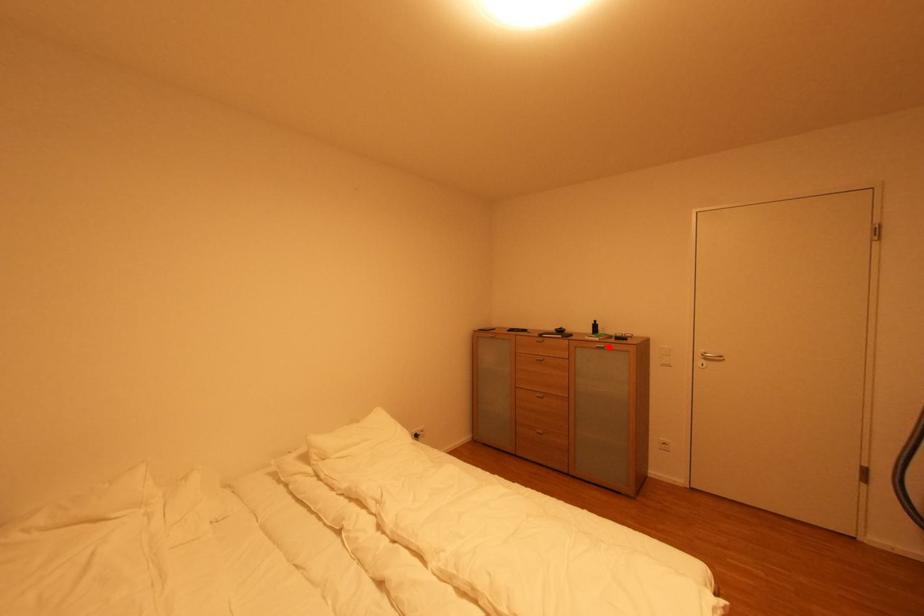
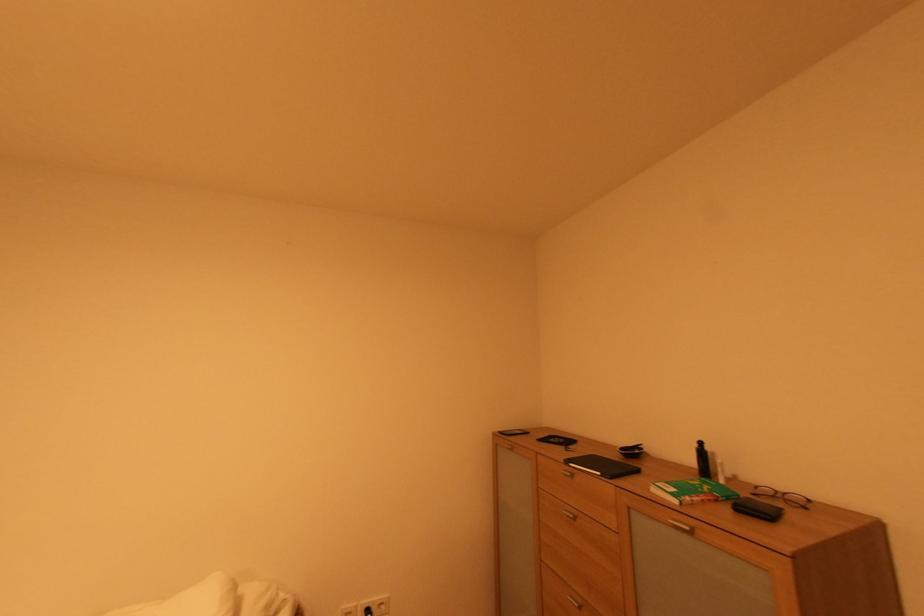
In the second image, find the point that corresponds to the highlighted location in the first image.

(694, 530)